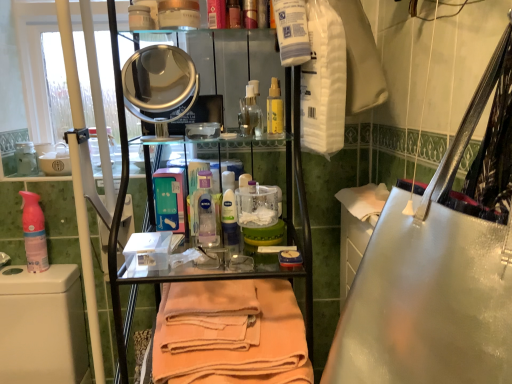
Question: From the image's perspective, is white plastic toilet at lower left on orange cotton towel at center?

Choices:
 (A) yes
 (B) no

Answer: (B)

Question: From a real-world perspective, is white plastic toilet at lower left physically above orange cotton towel at center?

Choices:
 (A) no
 (B) yes

Answer: (A)

Question: Is white plastic toilet at lower left located outside orange cotton towel at center?

Choices:
 (A) no
 (B) yes

Answer: (B)

Question: Is white plastic toilet at lower left further to the viewer compared to orange cotton towel at center?

Choices:
 (A) yes
 (B) no

Answer: (A)

Question: Can you confirm if white plastic toilet at lower left is wider than orange cotton towel at center?

Choices:
 (A) no
 (B) yes

Answer: (B)

Question: Is white plastic toilet at lower left aimed at orange cotton towel at center?

Choices:
 (A) yes
 (B) no

Answer: (B)

Question: Can you confirm if pink matte spray can at left, which is the 2th cleaning product from front to back, is taller than white plastic toilet at lower left?

Choices:
 (A) no
 (B) yes

Answer: (A)

Question: Is pink matte spray can at left, which is the 2th cleaning product from front to back, positioned beyond the bounds of white plastic toilet at lower left?

Choices:
 (A) no
 (B) yes

Answer: (B)

Question: From the image's perspective, would you say pink matte spray can at left, the 2th cleaning product viewed from the right, is shown under white plastic toilet at lower left?

Choices:
 (A) no
 (B) yes

Answer: (A)

Question: Can you confirm if pink matte spray can at left, placed as the first cleaning product when sorted from back to front, is bigger than white plastic toilet at lower left?

Choices:
 (A) no
 (B) yes

Answer: (A)

Question: Can you confirm if pink matte spray can at left, placed as the first cleaning product when sorted from back to front, is smaller than white plastic toilet at lower left?

Choices:
 (A) yes
 (B) no

Answer: (A)

Question: Is pink matte spray can at left, placed as the first cleaning product when sorted from back to front, positioned behind white plastic toilet at lower left?

Choices:
 (A) no
 (B) yes

Answer: (B)

Question: From the image's perspective, is translucent plastic bottle at center, the first cleaning product viewed from the right, above white plastic toilet at lower left?

Choices:
 (A) yes
 (B) no

Answer: (A)